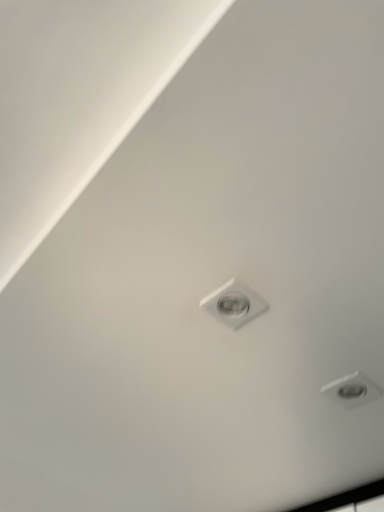
Question: Can you confirm if matte white droplight at lower right is taller than white glossy light bulb at center?

Choices:
 (A) yes
 (B) no

Answer: (B)

Question: Is matte white droplight at lower right bigger than white glossy light bulb at center?

Choices:
 (A) no
 (B) yes

Answer: (A)

Question: Can you confirm if matte white droplight at lower right is thinner than white glossy light bulb at center?

Choices:
 (A) yes
 (B) no

Answer: (A)

Question: Is matte white droplight at lower right shorter than white glossy light bulb at center?

Choices:
 (A) yes
 (B) no

Answer: (A)

Question: Is matte white droplight at lower right to the right of white glossy light bulb at center from the viewer's perspective?

Choices:
 (A) yes
 (B) no

Answer: (A)

Question: Is matte white droplight at lower right facing towards white glossy light bulb at center?

Choices:
 (A) yes
 (B) no

Answer: (A)

Question: Is white glossy light bulb at center thinner than matte white droplight at lower right?

Choices:
 (A) no
 (B) yes

Answer: (A)

Question: Is matte white droplight at lower right inside white glossy light bulb at center?

Choices:
 (A) no
 (B) yes

Answer: (A)

Question: Does white glossy light bulb at center turn towards matte white droplight at lower right?

Choices:
 (A) yes
 (B) no

Answer: (B)

Question: Considering the relative positions of white glossy light bulb at center and matte white droplight at lower right in the image provided, is white glossy light bulb at center to the right of matte white droplight at lower right from the viewer's perspective?

Choices:
 (A) yes
 (B) no

Answer: (B)

Question: From a real-world perspective, is white glossy light bulb at center physically below matte white droplight at lower right?

Choices:
 (A) no
 (B) yes

Answer: (A)

Question: Are white glossy light bulb at center and matte white droplight at lower right located far from each other?

Choices:
 (A) no
 (B) yes

Answer: (A)

Question: In terms of height, does matte white droplight at lower right look taller or shorter compared to white glossy light bulb at center?

Choices:
 (A) short
 (B) tall

Answer: (A)